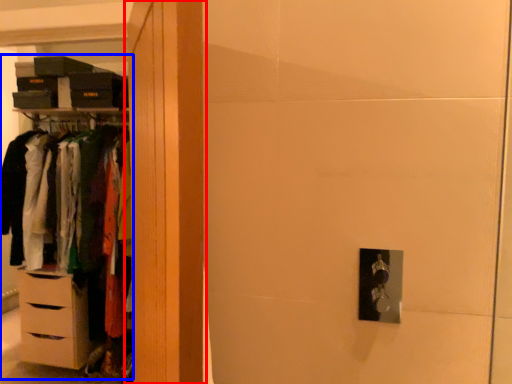
Question: Which point is further to the camera, armoire (highlighted by a red box) or dresser (highlighted by a blue box)?

Choices:
 (A) armoire
 (B) dresser

Answer: (B)